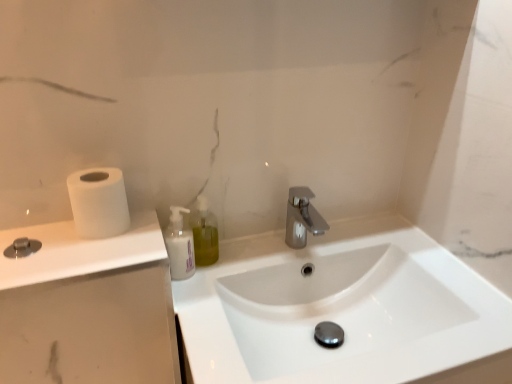
Find the location of a particular element. free location to the right of white matte toilet paper at left is located at coordinates (141, 228).